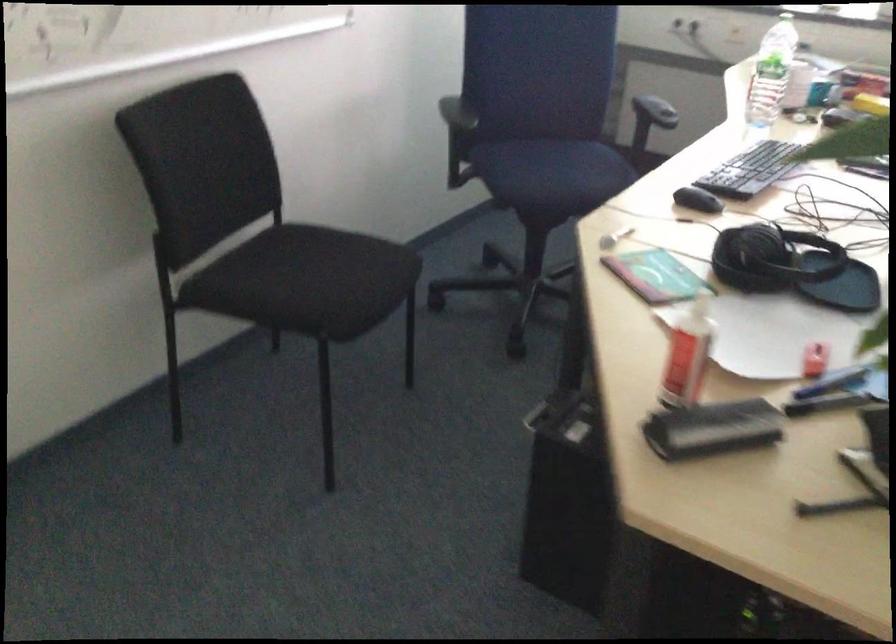
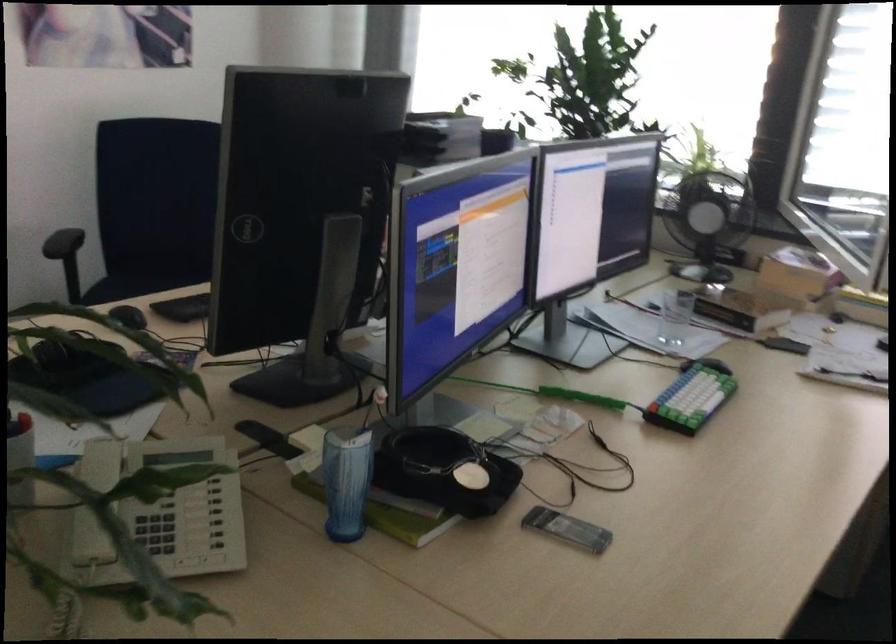
Question: Which direction would the cameraman need to move to produce the second image? Reply with the corresponding letter.

Choices:
 (A) Left
 (B) Right
 (C) Forward
 (D) Backward

Answer: (B)